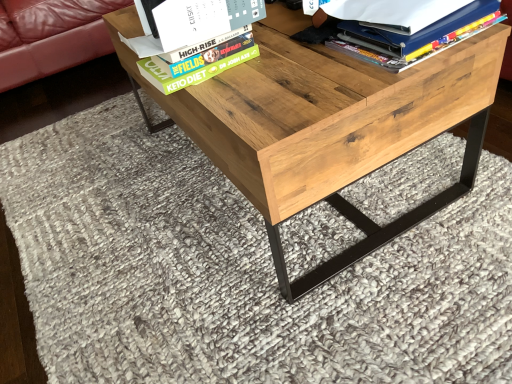
You are a GUI agent. You are given a task and a screenshot of the screen. Output one action in this format:
    pyautogui.click(x=<x>, y=<y>)
    Task: Click on the vacant area that lies to the right of hardcover book at upper center
    
    Given the screenshot: What is the action you would take?
    pyautogui.click(x=282, y=53)